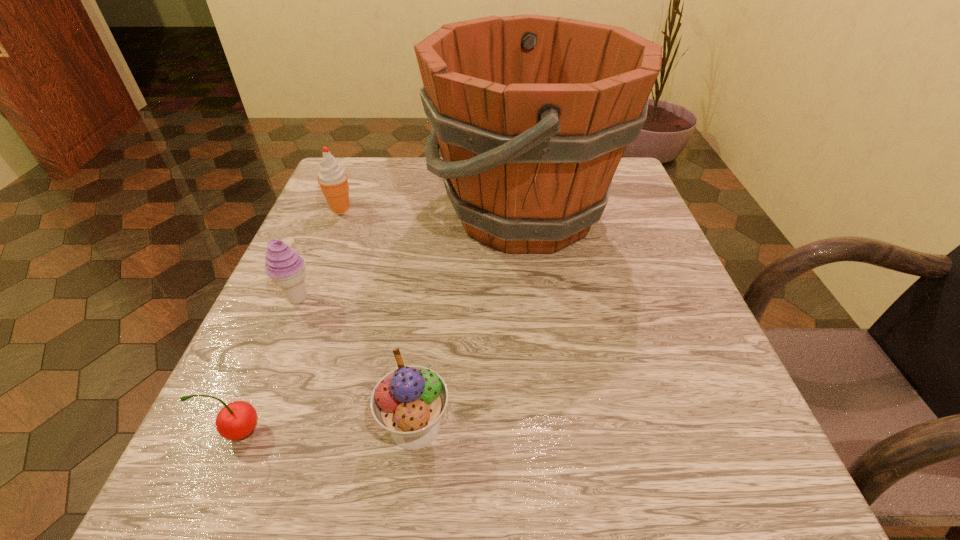
At what (x,y) coordinates should I click in order to perform the action: click on vacant position located 0.150m on the left of the rightmost icecream. Please return your answer as a coordinate pair (x, y). This screenshot has height=540, width=960. Looking at the image, I should click on (268, 427).

Find the location of a particular element. This screenshot has height=540, width=960. vacant area situated on the right of the shortest object is located at coordinates (540, 430).

In order to click on bucket that is at the far edge in this screenshot , I will do `click(532, 114)`.

Locate an element on the screen. This screenshot has height=540, width=960. icecream that is positioned at the far edge is located at coordinates (333, 180).

You are a GUI agent. You are given a task and a screenshot of the screen. Output one action in this format:
    pyautogui.click(x=<x>, y=<y>)
    Task: Click on the icecream at the near edge
    The width and height of the screenshot is (960, 540).
    Given the screenshot: What is the action you would take?
    pyautogui.click(x=408, y=402)

This screenshot has width=960, height=540. I want to click on cherry that is at the near edge, so click(236, 420).

Image resolution: width=960 pixels, height=540 pixels. I want to click on cherry present at the left edge, so click(236, 420).

What are the coordinates of `object located in the right edge section of the desktop` in the screenshot? It's located at (532, 114).

This screenshot has height=540, width=960. In order to click on object at the far left corner in this screenshot , I will do `click(333, 180)`.

The image size is (960, 540). Find the location of `object situated at the near left corner`. object situated at the near left corner is located at coordinates (236, 420).